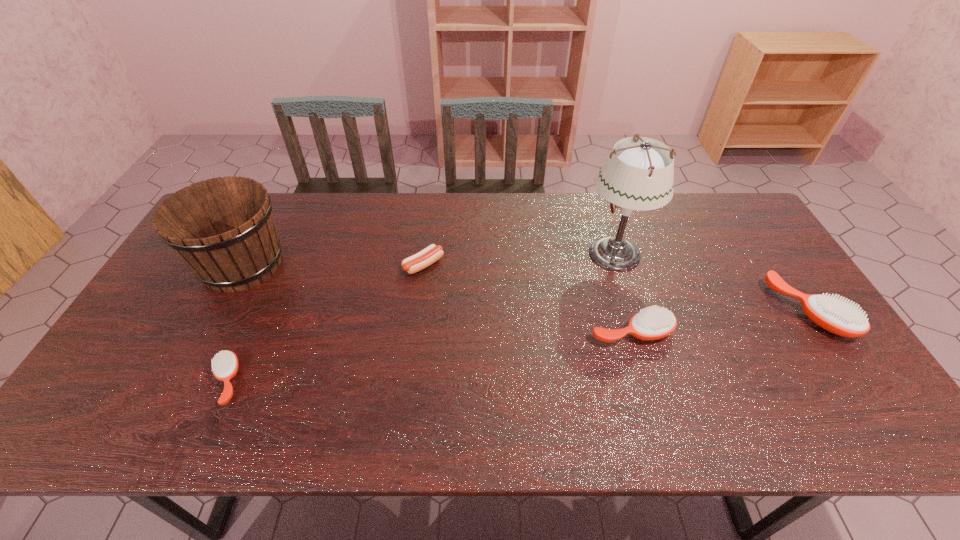
You are a GUI agent. You are given a task and a screenshot of the screen. Output one action in this format:
    pyautogui.click(x=<x>, y=<y>)
    Task: Click on the nearest object
    Image resolution: width=960 pixels, height=540 pixels.
    Given the screenshot: What is the action you would take?
    pyautogui.click(x=225, y=364)

You are a GUI agent. You are given a task and a screenshot of the screen. Output one action in this format:
    pyautogui.click(x=<x>, y=<y>)
    Task: Click on the shortest hairbrush
    Image resolution: width=960 pixels, height=540 pixels.
    Given the screenshot: What is the action you would take?
    pyautogui.click(x=225, y=364)

Where is `the second hairbrush from right to left`? The image size is (960, 540). the second hairbrush from right to left is located at coordinates (654, 323).

I want to click on the fourth tallest object, so click(x=654, y=323).

The image size is (960, 540). Find the location of `the rightmost hairbrush`. the rightmost hairbrush is located at coordinates (837, 316).

In order to click on the tallest object in this screenshot , I will do `click(639, 175)`.

The image size is (960, 540). Identify the location of the fourth object from right to left. (419, 261).

Where is `wine bucket`? wine bucket is located at coordinates (223, 228).

The image size is (960, 540). What are the coordinates of `vacant space located on the right of the nearest object` in the screenshot? It's located at (326, 381).

This screenshot has width=960, height=540. What are the coordinates of `free spot located 0.060m on the left of the third shortest object` in the screenshot? It's located at (566, 332).